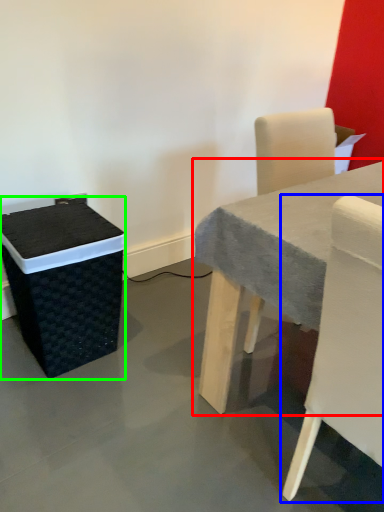
Question: Which object is positioned farthest from table (highlighted by a red box)? Select from chair (highlighted by a blue box) and storage box (highlighted by a green box).

Choices:
 (A) chair
 (B) storage box

Answer: (B)